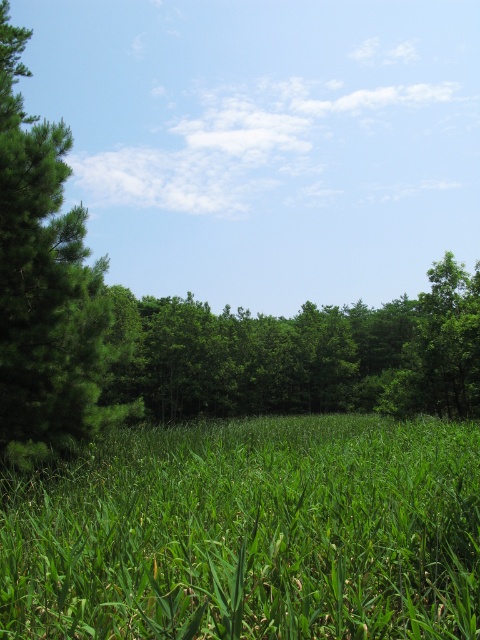
You are standing at the camera position and want to walk directly to the green leafy tree at center. How far will you have to walk?

The green leafy tree at center is 11.50 meters away from camera, so you will have to walk 11.50 meters to reach it.

You are standing in the middle of the forest and want to walk towards the green leafy tree at center and the green leafy tree at left. Which tree will you reach first?

The green leafy tree at center is closer to you than the green leafy tree at left, so you will reach the green leafy tree at center first.